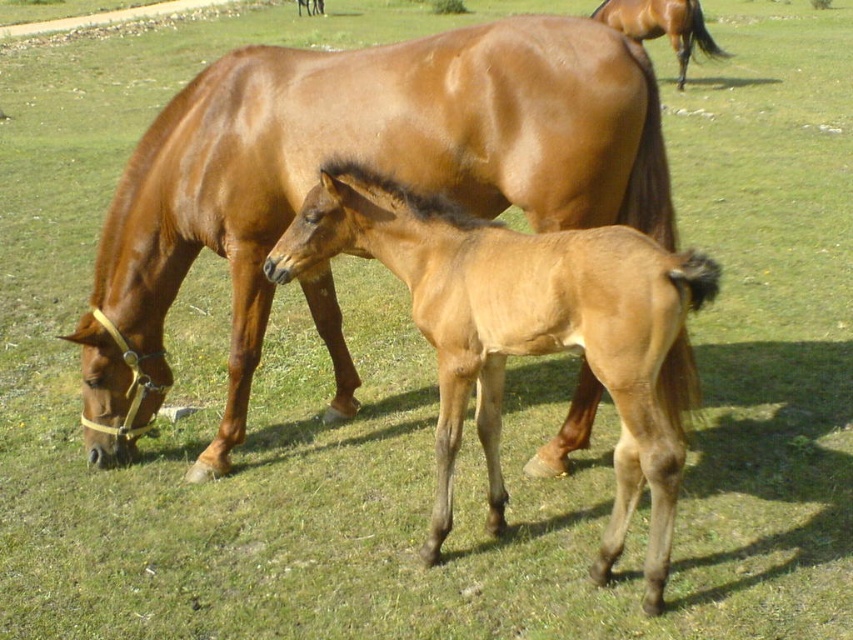
Is glossy brown horse at center taller than brown glossy horse at upper right?

Yes.

Who is more distant from viewer, (289, 163) or (624, 6)?

The point (624, 6) is more distant.

What do you see at coordinates (367, 163) in the screenshot? Image resolution: width=853 pixels, height=640 pixels. I see `glossy brown horse at center` at bounding box center [367, 163].

Locate an element on the screen. The image size is (853, 640). glossy brown horse at center is located at coordinates (367, 163).

Is glossy brown horse at center closer to camera compared to light brown glossy foal at center?

No.

Between point (276, 188) and point (490, 490), which one is positioned behind?

Positioned behind is point (276, 188).

Find the location of a particular element. The image size is (853, 640). glossy brown horse at center is located at coordinates (367, 163).

Can you confirm if light brown glossy foal at center is positioned to the left of brown glossy horse at upper right?

Yes, light brown glossy foal at center is to the left of brown glossy horse at upper right.

Locate an element on the screen. This screenshot has height=640, width=853. light brown glossy foal at center is located at coordinates (526, 332).

Where is `light brown glossy foal at center`? The image size is (853, 640). light brown glossy foal at center is located at coordinates (526, 332).